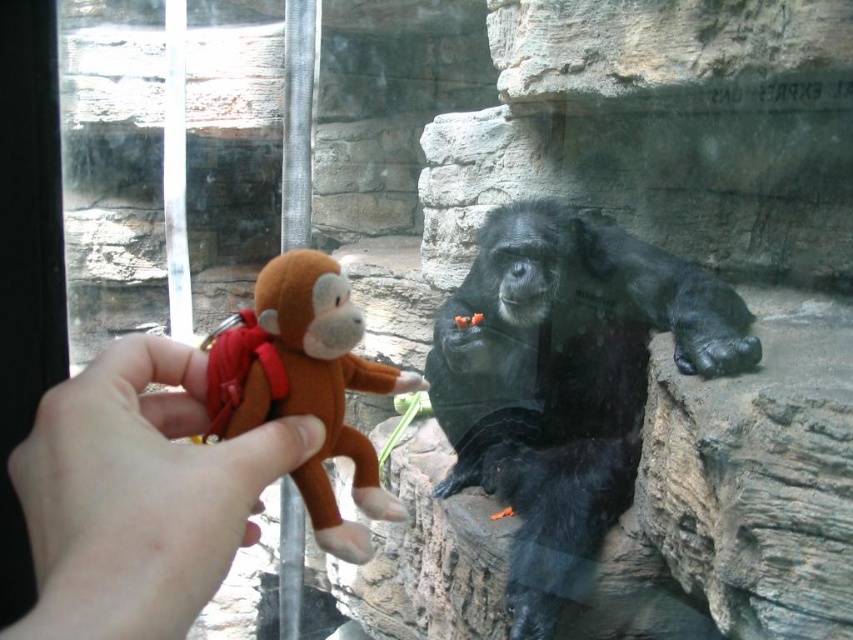
Question: Among these objects, which one is nearest to the camera?

Choices:
 (A) brown plush monkey at left
 (B) brown plush toy at left

Answer: (B)

Question: Among these points, which one is farthest from the camera?

Choices:
 (A) (515, 321)
 (B) (309, 259)

Answer: (A)

Question: Is brown plush monkey at center bigger than brown plush monkey at left?

Choices:
 (A) no
 (B) yes

Answer: (B)

Question: Which object is the closest to the brown plush toy at left?

Choices:
 (A) brown plush monkey at left
 (B) brown plush monkey at center

Answer: (A)

Question: Can you confirm if brown plush monkey at center is wider than brown plush toy at left?

Choices:
 (A) yes
 (B) no

Answer: (A)

Question: Does brown plush monkey at center appear on the right side of brown plush toy at left?

Choices:
 (A) yes
 (B) no

Answer: (A)